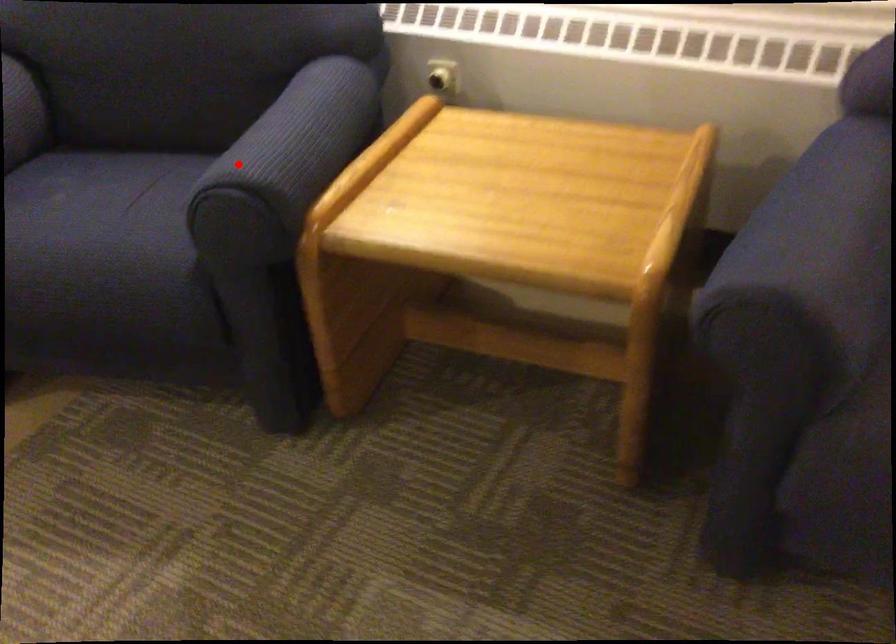
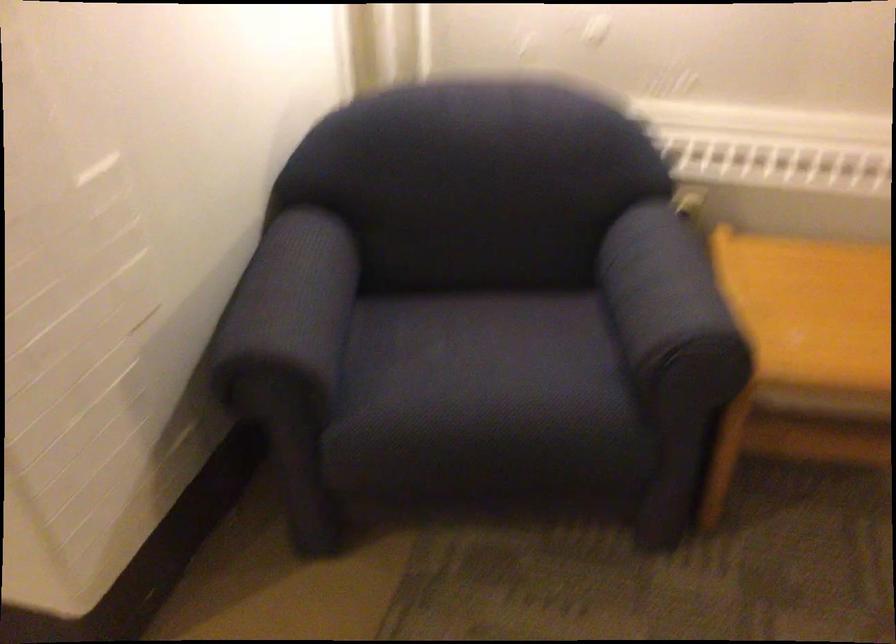
Where in the second image is the point corresponding to the highlighted location from the first image?

(670, 307)